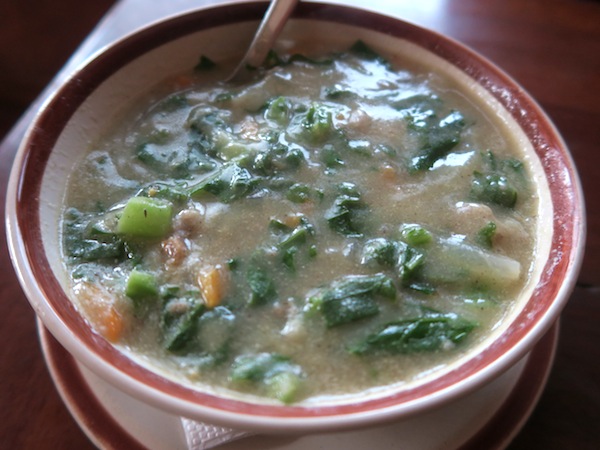
The width and height of the screenshot is (600, 450). What are the coordinates of `table` in the screenshot? It's located at (523, 57).